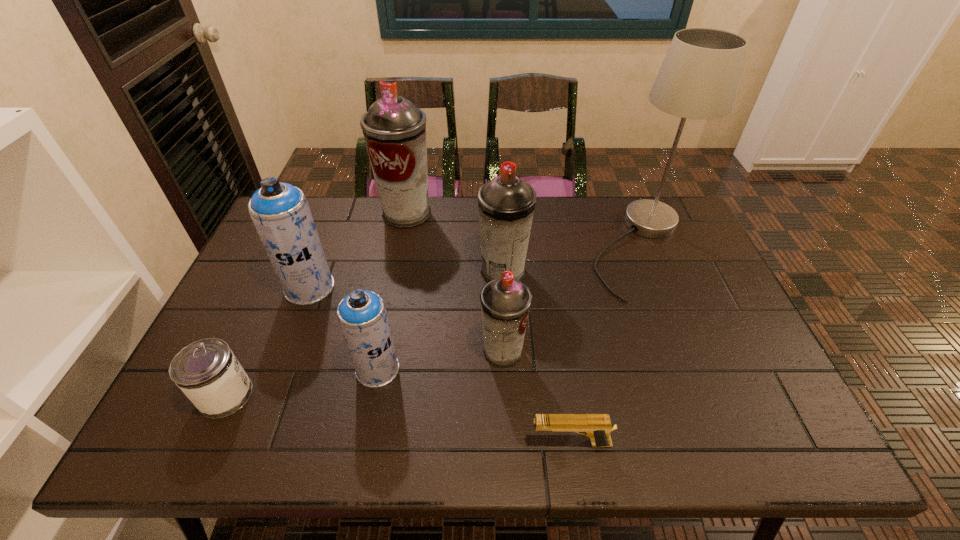
Locate an element on the screen. This screenshot has width=960, height=540. the second shortest object is located at coordinates (206, 371).

You are a GUI agent. You are given a task and a screenshot of the screen. Output one action in this format:
    pyautogui.click(x=<x>, y=<y>)
    Task: Click on the nearest object
    
    Given the screenshot: What is the action you would take?
    click(x=597, y=427)

Identify the location of pistol. (597, 427).

The width and height of the screenshot is (960, 540). Identify the location of free region located on the front of the rightmost object. (712, 429).

Locate an element on the screen. vacant space located 0.350m on the right of the farthest gray aerosol can is located at coordinates (535, 213).

Image resolution: width=960 pixels, height=540 pixels. I want to click on blank space located 0.350m on the right of the second smallest gray aerosol can, so click(646, 272).

Locate an element on the screen. The width and height of the screenshot is (960, 540). free space located 0.300m on the back of the farther blue aerosol can is located at coordinates (339, 211).

Find the location of a particular element. The image size is (960, 540). free spot located 0.140m on the front of the smaller blue aerosol can is located at coordinates (363, 446).

The image size is (960, 540). I want to click on blank space located on the back of the smallest gray aerosol can, so click(x=500, y=287).

The width and height of the screenshot is (960, 540). In order to click on vacant point located on the back of the second shortest object in this screenshot , I will do `click(273, 292)`.